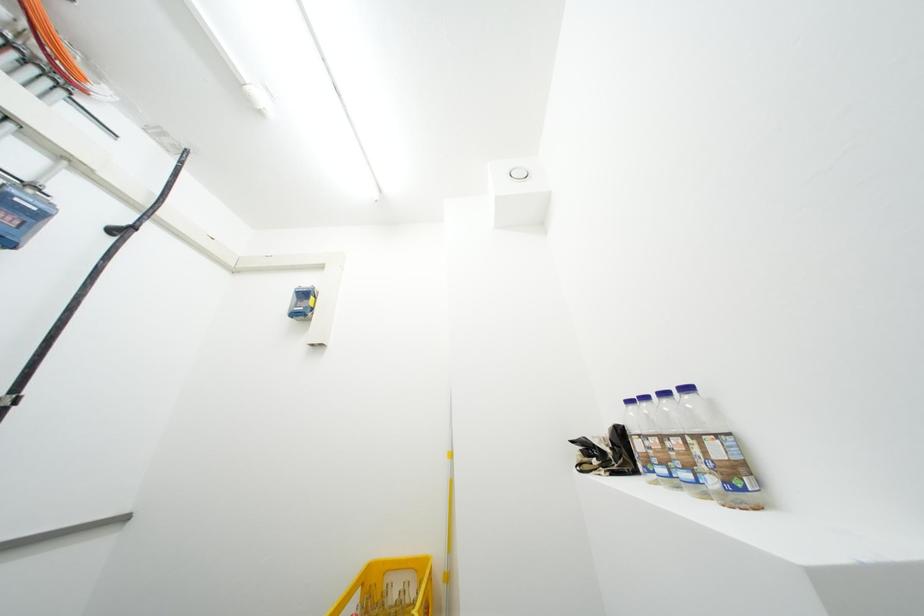
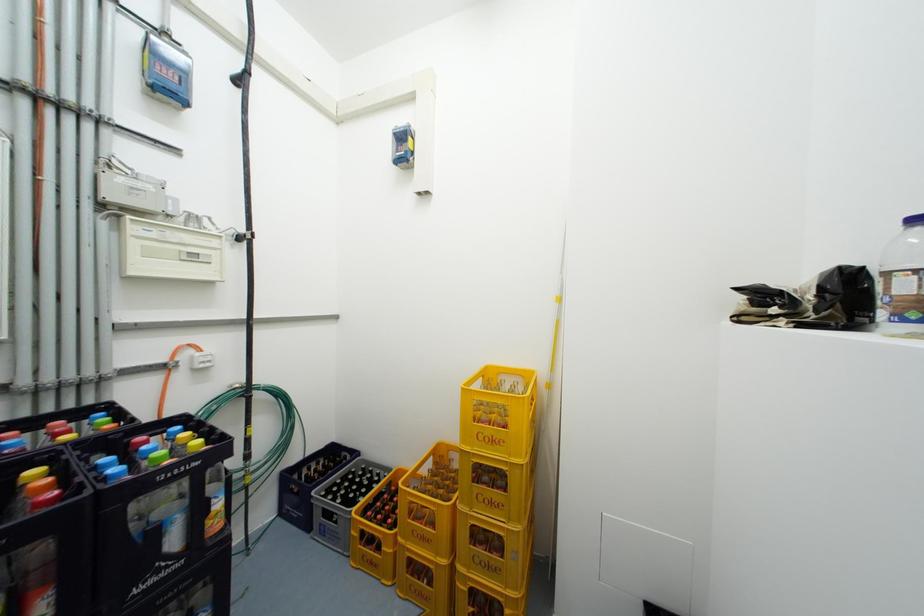
Based on the continuous images, in which direction is the camera rotating?

The camera's rotation is toward left-down.